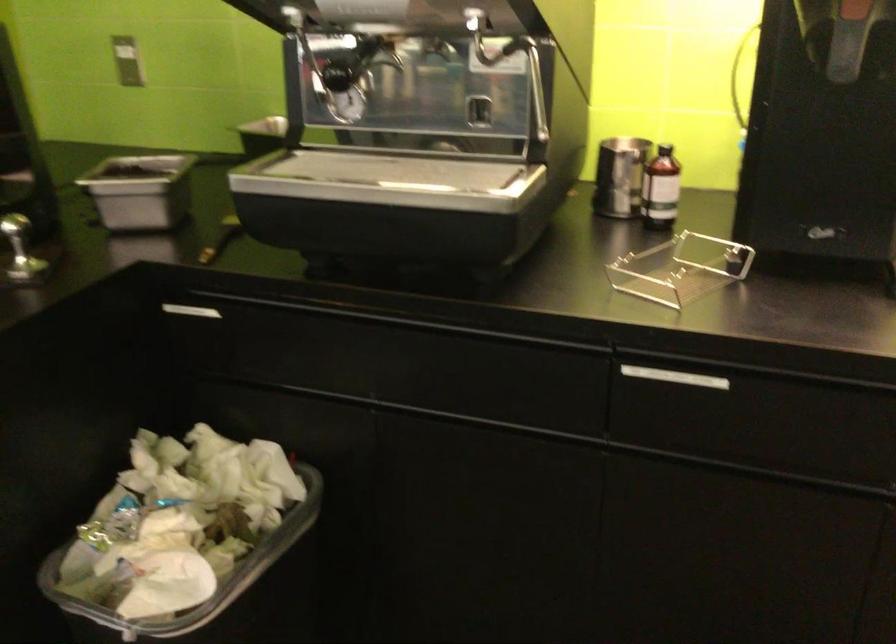
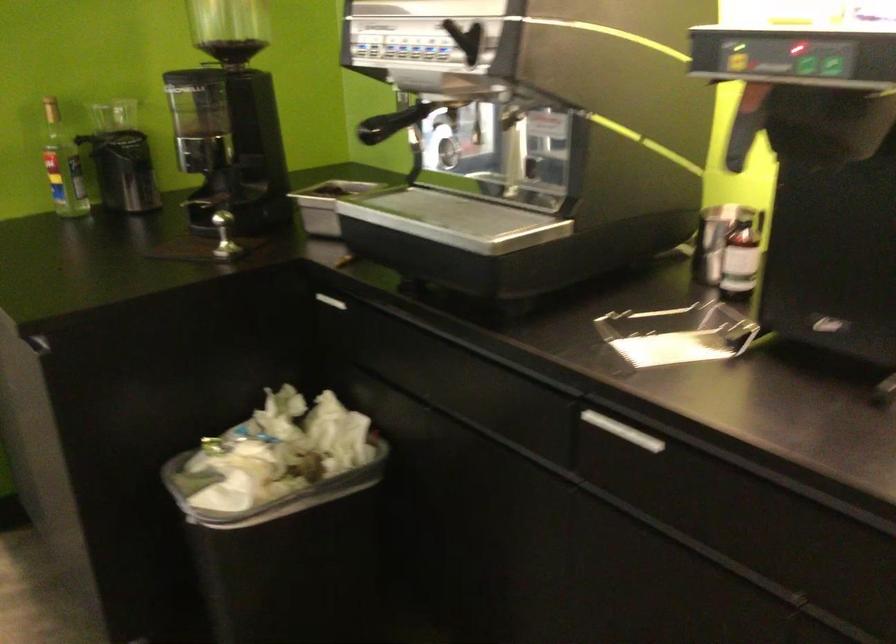
Question: The first image is from the beginning of the video and the second image is from the end. How did the camera likely rotate when shooting the video?

Choices:
 (A) Left
 (B) Right
 (C) Up
 (D) Down

Answer: (A)